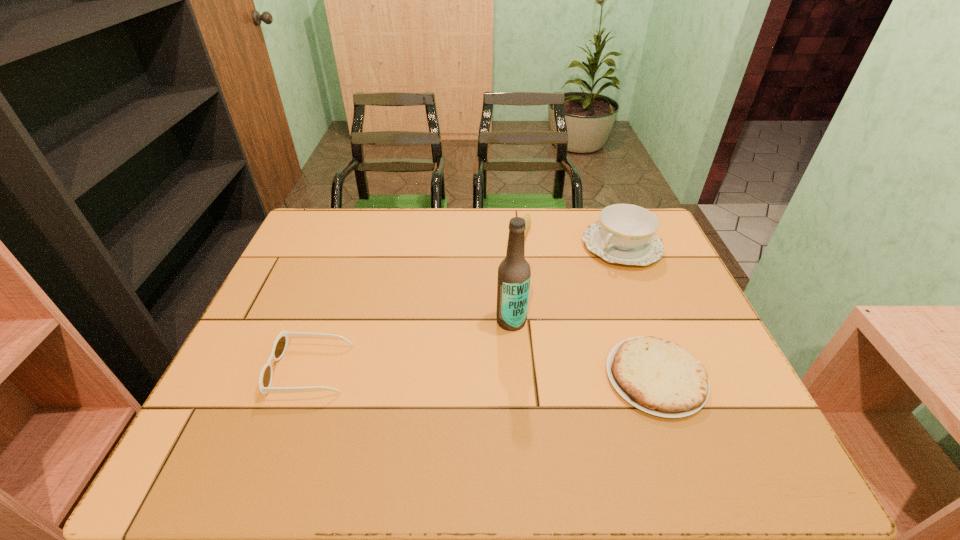
Where is `free space at the left edge of the desktop`? This screenshot has height=540, width=960. free space at the left edge of the desktop is located at coordinates (274, 313).

In the image, there is a desktop. Where is `free space at the right edge`? This screenshot has height=540, width=960. free space at the right edge is located at coordinates (677, 272).

This screenshot has width=960, height=540. In order to click on vacant region at the far left corner of the desktop in this screenshot , I will do `click(347, 208)`.

Image resolution: width=960 pixels, height=540 pixels. Identify the location of vacant space at the near left corner of the desktop. (267, 417).

In order to click on free point between the beer bottle and the tortilla in this screenshot , I will do `click(584, 349)`.

What are the coordinates of `empty location between the tortilla and the banana` in the screenshot? It's located at (588, 306).

You are a GUI agent. You are given a task and a screenshot of the screen. Output one action in this format:
    pyautogui.click(x=<x>, y=<y>)
    Task: Click on the unoccupied position between the third farthest object and the shortest object
    
    Given the screenshot: What is the action you would take?
    pyautogui.click(x=584, y=349)

This screenshot has width=960, height=540. I want to click on free space between the tallest object and the chinaware, so click(566, 284).

The height and width of the screenshot is (540, 960). Identify the location of empty space that is in between the banana and the sunglasses. pyautogui.click(x=416, y=302).

At what (x,y) coordinates should I click in order to perform the action: click on unoccupied area between the tortilla and the banana. Please return your answer as a coordinate pair (x, y). The width and height of the screenshot is (960, 540). Looking at the image, I should click on (588, 306).